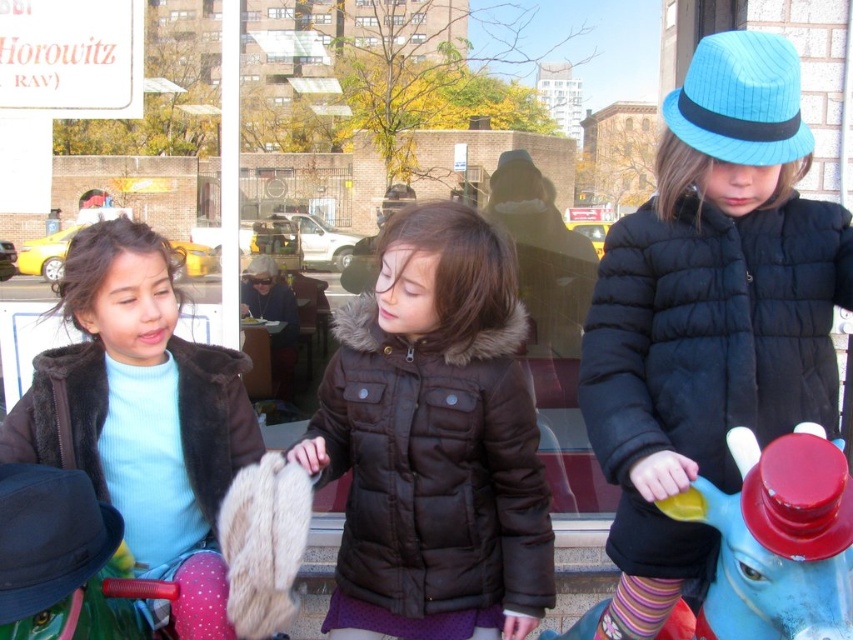
You are a photographer trying to capture a group photo of the children in the scene. You want to ensure that all of them are visible in the frame. Given that the black puffy jacket at center and the light blue fleece jacket at left are the two widest garments, which one should you position closer to the center to avoid them overlapping with others?

The black puffy jacket at center might be wider than light blue fleece jacket at left, so positioning the black puffy jacket at center closer to the center would help avoid overlapping with others since it is potentially wider.

You are a photographer trying to capture a clear shot of both the blue plastic horse at right and the light blue fleece jacket at left. Since the horse is closer to you, will it appear larger in the photo compared to the jacket?

Yes, the blue plastic horse at right appears larger in the photo because it is closer to the viewer than the light blue fleece jacket at left.

What are the coordinates of the blue plastic horse at right?

The blue plastic horse at right is located at coordinates point (x=773, y=541).